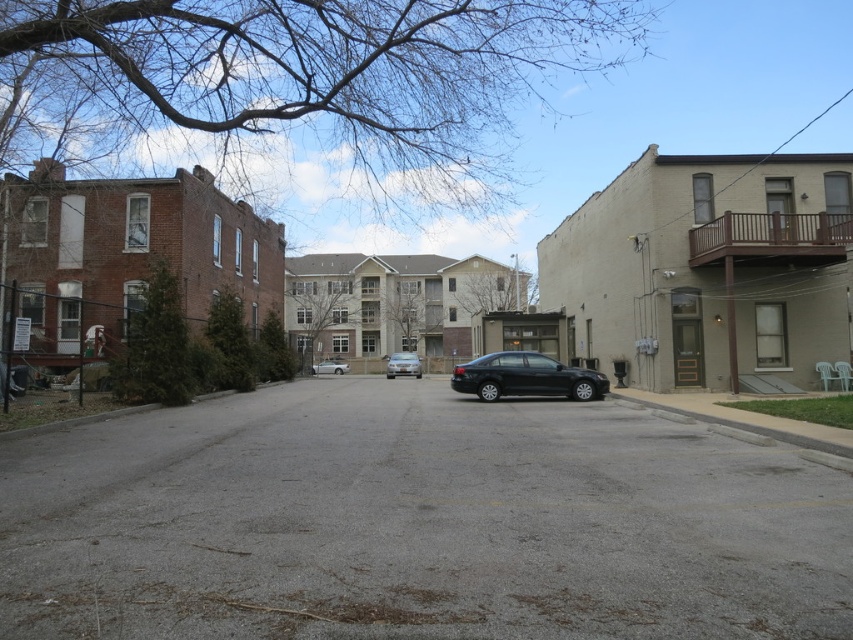
You are standing at the camera position and want to walk to the gray asphalt road at center. What direction should you move in to reach it?

To reach the gray asphalt road at center, you should move forward since it is located directly ahead at point [416,524] from your current position.

You are a delivery person trying to navigate through the urban street scene. You need to drive your van from the parking lot to the brick building on the left. According to the image, is the gray asphalt road at center a suitable path to reach the silver metallic car at center before arriving at the brick building?

The gray asphalt road at center is above the silver metallic car at center, so the road is positioned higher than the car. This means the road might be elevated or on a different level, making it unsuitable to directly reach the silver metallic car at center before the brick building. You should consider an alternative route closer to ground level.